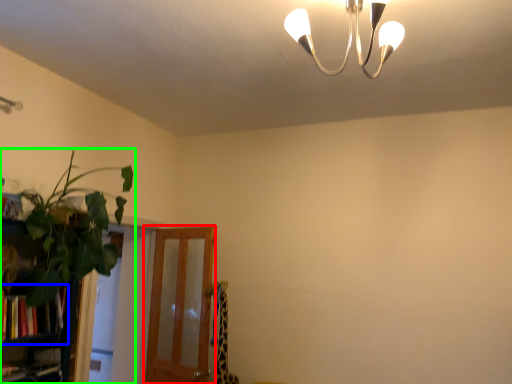
Question: Which is farther away from screen door (highlighted by a red box)? book (highlighted by a blue box) or houseplant (highlighted by a green box)?

Choices:
 (A) book
 (B) houseplant

Answer: (A)